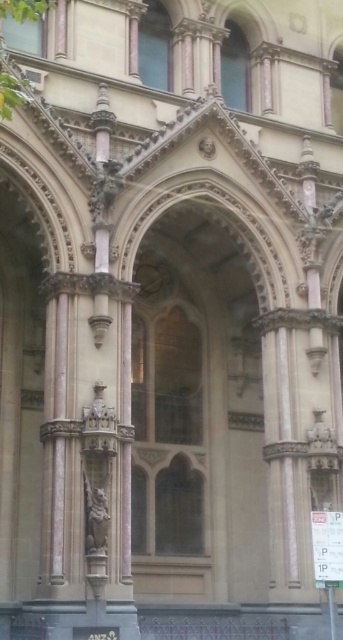
Question: Among these objects, which one is nearest to the camera?

Choices:
 (A) beige stone archway at center
 (B) carved stone statue at center

Answer: (B)

Question: Is beige stone archway at center bigger than carved stone statue at center?

Choices:
 (A) yes
 (B) no

Answer: (A)

Question: Is beige stone archway at center further to the viewer compared to carved stone statue at center?

Choices:
 (A) yes
 (B) no

Answer: (A)

Question: Which of the following is the closest to the observer?

Choices:
 (A) carved stone statue at center
 (B) beige stone archway at center

Answer: (A)

Question: Where is beige stone archway at center located in relation to carved stone statue at center in the image?

Choices:
 (A) right
 (B) left

Answer: (A)